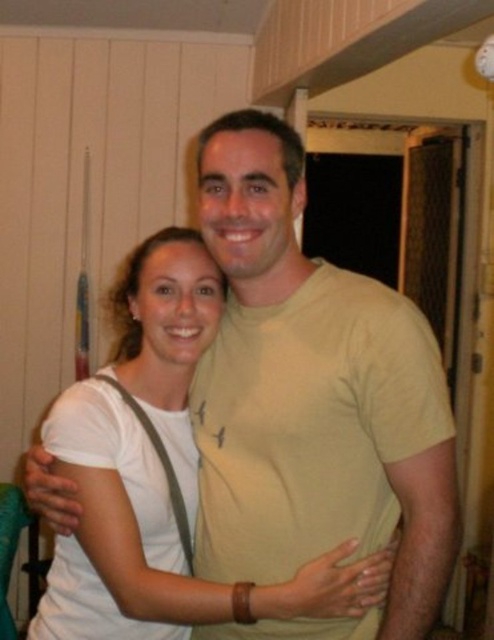
You are taking a photo of two people in a room with wooden paneling. You notice two points in the image at coordinates point (406, 484) and point (190, 451). Which point is closer to the camera?

Point (406, 484) is closer to the camera than point (190, 451).